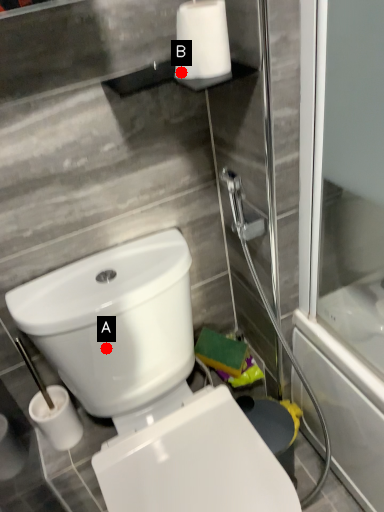
Question: Two points are circled on the image, labeled by A and B beside each circle. Which point appears closest to the camera in this image?

Choices:
 (A) A is closer
 (B) B is closer

Answer: (B)